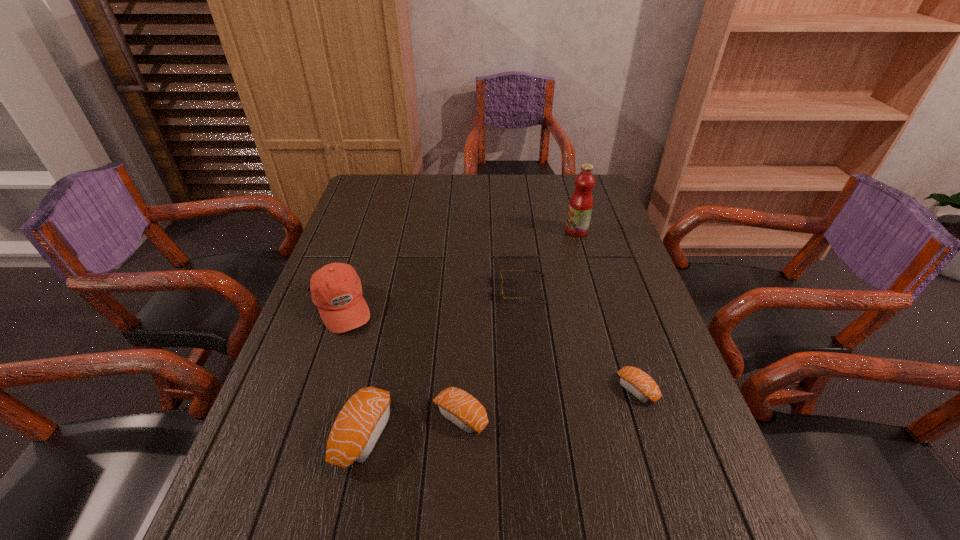
Point out which sushi is positioned as the second nearest to the fourth shortest object. Please provide its 2D coordinates. Your answer should be formatted as a tuple, i.e. [(x, y)], where the tuple contains the x and y coordinates of a point satisfying the conditions above.

[(637, 382)]

In order to click on vacant region that satisfies the following two spatial constraints: 1. on the front-facing side of the sunglasses; 2. on the front side of the third shortest object in this screenshot , I will do `click(538, 417)`.

Locate an element on the screen. This screenshot has height=540, width=960. free space that satisfies the following two spatial constraints: 1. on the back side of the shortest sushi; 2. on the left side of the fourth tallest object is located at coordinates (462, 389).

This screenshot has width=960, height=540. In order to click on vacant point that satisfies the following two spatial constraints: 1. on the front label of the tallest object; 2. on the front side of the baseball cap in this screenshot , I will do `click(598, 307)`.

You are a GUI agent. You are given a task and a screenshot of the screen. Output one action in this format:
    pyautogui.click(x=<x>, y=<y>)
    Task: Click on the free space that satisfies the following two spatial constraints: 1. on the front label of the tallest object; 2. on the right side of the rightmost sushi
    Image resolution: width=960 pixels, height=540 pixels.
    Given the screenshot: What is the action you would take?
    pyautogui.click(x=622, y=389)

The width and height of the screenshot is (960, 540). Find the location of `free space that satisfies the following two spatial constraints: 1. on the front label of the fruit juice; 2. on the front side of the fourth shortest object`. free space that satisfies the following two spatial constraints: 1. on the front label of the fruit juice; 2. on the front side of the fourth shortest object is located at coordinates (635, 433).